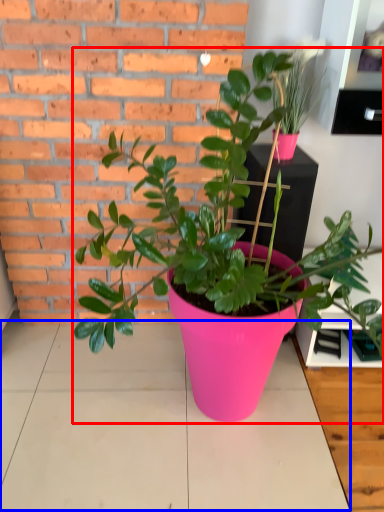
Question: Which point is closer to the camera, houseplant (highlighted by a red box) or table top (highlighted by a blue box)?

Choices:
 (A) houseplant
 (B) table top

Answer: (A)